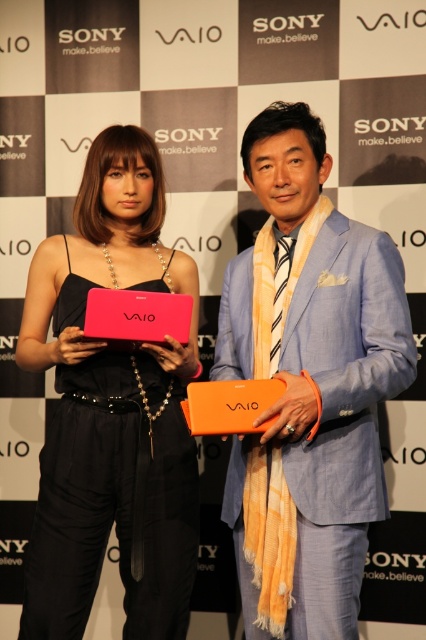
Based on the photo, does orange fabric scarf at center have a greater width compared to matte pink laptop at center?

In fact, orange fabric scarf at center might be narrower than matte pink laptop at center.

The image size is (426, 640). What are the coordinates of `orange fabric scarf at center` in the screenshot? It's located at (308, 385).

I want to click on orange fabric scarf at center, so click(308, 385).